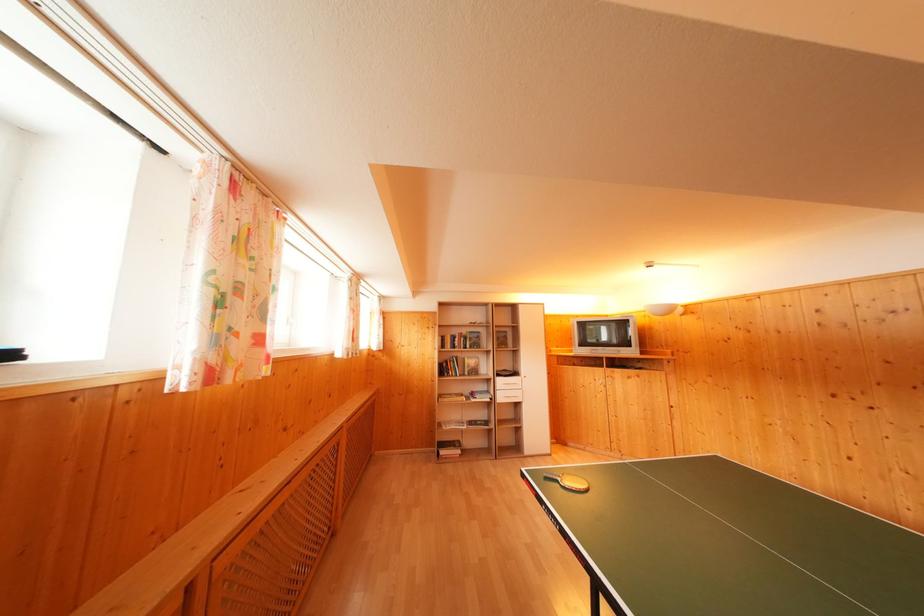
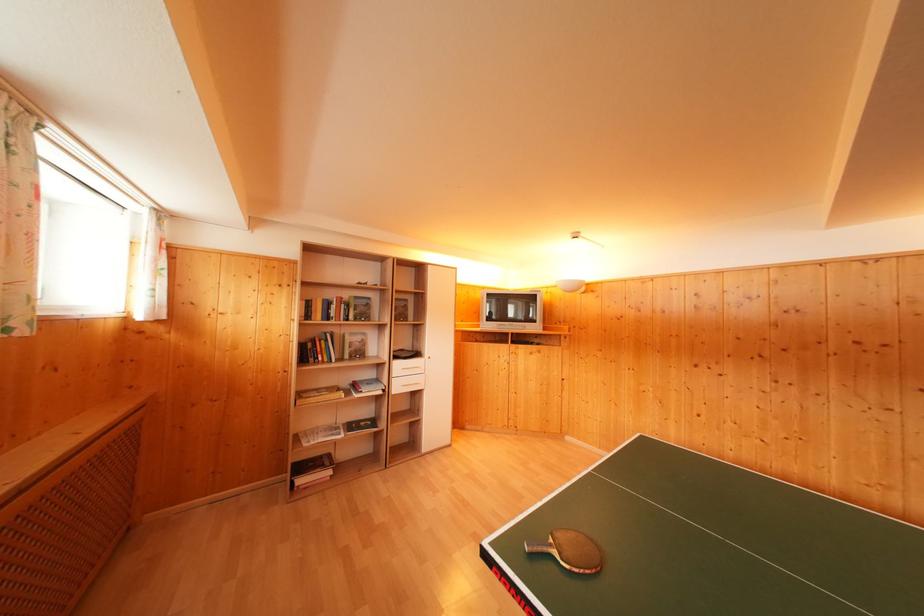
Find the pixel in the second image that matches point (469, 361) in the first image.

(350, 336)